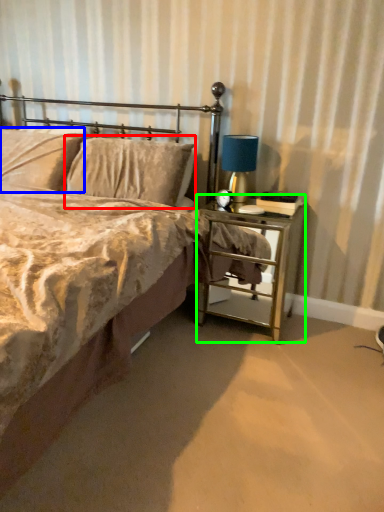
Question: Considering the real-world distances, which object is closest to pillow (highlighted by a red box)? pillow (highlighted by a blue box) or nightstand (highlighted by a green box).

Choices:
 (A) pillow
 (B) nightstand

Answer: (A)